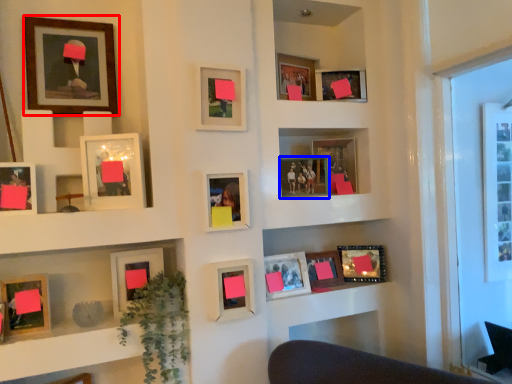
Question: Which object is further to the camera taking this photo, picture frame (highlighted by a red box) or picture frame (highlighted by a blue box)?

Choices:
 (A) picture frame
 (B) picture frame

Answer: (B)